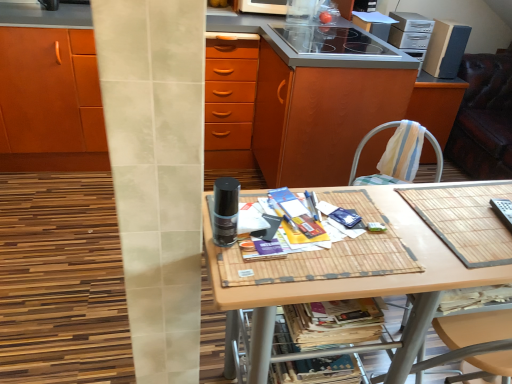
What do you see at coordinates (66, 152) in the screenshot?
I see `matte wood cabinet at center` at bounding box center [66, 152].

Locate an element on the screen. The width and height of the screenshot is (512, 384). striped fabric chair at right is located at coordinates (365, 144).

Where is `wooden at center`? This screenshot has height=384, width=512. wooden at center is located at coordinates (319, 96).

Where is `printed paper magazine at lower center, positioned as the 2th magazine in top-to-bottom order`? printed paper magazine at lower center, positioned as the 2th magazine in top-to-bottom order is located at coordinates (334, 322).

Describe the element at coordinates (446, 49) in the screenshot. I see `cardboard speaker at upper right` at that location.

You are a GUI agent. You are given a task and a screenshot of the screen. Output one action in this format:
    pyautogui.click(x=<x>, y=<y>)
    Task: Click on the transparent plastic container at upper center, placed as the 1th appliance when sorted from top to bottom
    
    Given the screenshot: What is the action you would take?
    pyautogui.click(x=301, y=11)

In order to face black glass stove at upper center, which appears as the 2th appliance when viewed from the top, should I rotate leftwards or rightwards?

To face it directly, rotate right by 9.849 degrees.

Where is `matte wood cabinet at center`? The image size is (512, 384). matte wood cabinet at center is located at coordinates (66, 152).

Considering the sizes of objects matte paper magazine at center, arranged as the 1th magazine when viewed from the top, and wooden at center in the image provided, who is taller, matte paper magazine at center, arranged as the 1th magazine when viewed from the top, or wooden at center?

Standing taller between the two is wooden at center.

Is matte paper magazine at center, arranged as the 1th magazine when viewed from the top, completely or partially outside of wooden at center?

matte paper magazine at center, arranged as the 1th magazine when viewed from the top, is positioned outside wooden at center.

Can you confirm if matte paper magazine at center, arranged as the 1th magazine when viewed from the top, is positioned to the left of wooden at center?

Yes.

The height and width of the screenshot is (384, 512). I want to click on chair in front of the cardboard speaker at upper right, so click(x=365, y=144).

Which of these two, striped fabric chair at right or cardboard speaker at upper right, is smaller?

With smaller size is striped fabric chair at right.

From the picture: From the image's perspective, which one is positioned lower, striped fabric chair at right or cardboard speaker at upper right?

striped fabric chair at right is shown below in the image.

In the scene shown: From a real-world perspective, is striped fabric chair at right over cardboard speaker at upper right?

Actually, striped fabric chair at right is physically below cardboard speaker at upper right in the real world.

In the scene shown: Is bamboo mat at center facing towards black plastic remote control at right, the 3th appliance positioned from the top?

No, bamboo mat at center is not oriented towards black plastic remote control at right, the 3th appliance positioned from the top.

Consider the image. Considering the positions of objects bamboo mat at center and black plastic remote control at right, the 3th appliance in the back-to-front sequence, in the image provided, who is more to the right, bamboo mat at center or black plastic remote control at right, the 3th appliance in the back-to-front sequence,?

black plastic remote control at right, the 3th appliance in the back-to-front sequence.

Between bamboo mat at center and black plastic remote control at right, the 3th appliance positioned from the top, which one is positioned behind?

black plastic remote control at right, the 3th appliance positioned from the top.

Considering the sizes of objects bamboo mat at center and black plastic remote control at right, the 1th appliance when ordered from front to back, in the image provided, who is thinner, bamboo mat at center or black plastic remote control at right, the 1th appliance when ordered from front to back,?

With smaller width is black plastic remote control at right, the 1th appliance when ordered from front to back.

Where is `the 2nd magazine to the left when counting from the cardboard speaker at upper right`? The height and width of the screenshot is (384, 512). the 2nd magazine to the left when counting from the cardboard speaker at upper right is located at coordinates (296, 220).

Considering the relative sizes of matte paper magazine at center, the second magazine in the bottom-to-top sequence, and cardboard speaker at upper right in the image provided, is matte paper magazine at center, the second magazine in the bottom-to-top sequence, taller than cardboard speaker at upper right?

No.

Considering the relative sizes of matte paper magazine at center, arranged as the 1th magazine when viewed from the top, and cardboard speaker at upper right in the image provided, is matte paper magazine at center, arranged as the 1th magazine when viewed from the top, smaller than cardboard speaker at upper right?

Indeed, matte paper magazine at center, arranged as the 1th magazine when viewed from the top, has a smaller size compared to cardboard speaker at upper right.

Is point (298, 239) more distant than point (458, 33)?

No.

Is black glass stove at upper center, the second appliance viewed from the back, smaller than bamboo mat at center?

Yes, black glass stove at upper center, the second appliance viewed from the back, is smaller than bamboo mat at center.

Is black glass stove at upper center, marked as the second appliance in a front-to-back arrangement, aimed at bamboo mat at center?

No.

The height and width of the screenshot is (384, 512). Identify the location of desk that is under the black glass stove at upper center, which is the 2th appliance in bottom-to-top order (from a real-world perspective). (357, 285).

Between black glass stove at upper center, the second appliance viewed from the back, and bamboo mat at center, which one has larger width?

black glass stove at upper center, the second appliance viewed from the back.

From the image's perspective, is matte wood cabinet at center under transparent plastic container at upper center, placed as the 1th appliance when sorted from top to bottom?

Yes, from the image's perspective, matte wood cabinet at center is beneath transparent plastic container at upper center, placed as the 1th appliance when sorted from top to bottom.

From a real-world perspective, which appliance is the 3rd one above the matte wood cabinet at center? Please provide its 2D coordinates.

[(301, 11)]

Based on the photo, does matte wood cabinet at center have a greater height compared to transparent plastic container at upper center, positioned as the third appliance in front-to-back order?

Indeed, matte wood cabinet at center has a greater height compared to transparent plastic container at upper center, positioned as the third appliance in front-to-back order.

Is matte wood cabinet at center completely or partially outside of transparent plastic container at upper center, the 3th appliance ordered from the bottom?

Yes, matte wood cabinet at center is outside of transparent plastic container at upper center, the 3th appliance ordered from the bottom.

Which is in front, leather-like swivel chair at right or matte wood cabinet at center?

matte wood cabinet at center is in front.

Consider the image. Which is nearer, (484, 55) or (434, 157)?

The point (434, 157) is closer.

Is leather-like swivel chair at right aimed at matte wood cabinet at center?

Yes, leather-like swivel chair at right is oriented towards matte wood cabinet at center.

Locate an element on the screen. dresser that appears on the right of matte paper magazine at center, the second magazine in the bottom-to-top sequence is located at coordinates (319, 96).

Find the location of `chair below the cardboard speaker at upper right (from a real-world perspective)`. chair below the cardboard speaker at upper right (from a real-world perspective) is located at coordinates (365, 144).

Estimate the real-world distances between objects in this image. Which object is closer to printed paper magazine at lower center, positioned as the 2th magazine in top-to-bottom order, transparent plastic container at upper center, the 3th appliance ordered from the bottom, or striped fabric chair at right?

The object closer to printed paper magazine at lower center, positioned as the 2th magazine in top-to-bottom order, is striped fabric chair at right.

When comparing their distances from leather-like swivel chair at right, does cardboard speaker at upper right or matte paper magazine at center, the second magazine in the bottom-to-top sequence, seem further?

matte paper magazine at center, the second magazine in the bottom-to-top sequence, lies further to leather-like swivel chair at right than the other object.

When comparing their distances from transparent plastic container at upper center, placed as the 1th appliance when sorted from top to bottom, does leather-like swivel chair at right or matte paper magazine at center, the second magazine in the bottom-to-top sequence, seem closer?

The object closer to transparent plastic container at upper center, placed as the 1th appliance when sorted from top to bottom, is leather-like swivel chair at right.

Considering their positions, is black glass stove at upper center, which appears as the 2th appliance when viewed from the top, positioned further to black plastic remote control at right, acting as the first appliance starting from the bottom, than wooden at center?

The object further to black plastic remote control at right, acting as the first appliance starting from the bottom, is black glass stove at upper center, which appears as the 2th appliance when viewed from the top.

Looking at the image, which one is located further to wooden at center, bamboo mat at center or black plastic remote control at right, acting as the first appliance starting from the bottom?

black plastic remote control at right, acting as the first appliance starting from the bottom, is further to wooden at center.

When comparing their distances from matte wood cabinet at center, does bamboo mat at center or transparent plastic container at upper center, placed as the 1th appliance when sorted from top to bottom, seem closer?

transparent plastic container at upper center, placed as the 1th appliance when sorted from top to bottom.

When comparing their distances from leather-like swivel chair at right, does black glass stove at upper center, the second appliance viewed from the back, or black plastic remote control at right, acting as the first appliance starting from the bottom, seem closer?

black glass stove at upper center, the second appliance viewed from the back, is positioned closer to the anchor leather-like swivel chair at right.

In the scene shown: When comparing their distances from leather-like swivel chair at right, does black plastic remote control at right, the 3th appliance in the back-to-front sequence, or cardboard speaker at upper right seem closer?

cardboard speaker at upper right is closer to leather-like swivel chair at right.

This screenshot has width=512, height=384. Find the location of `dresser located between matte paper magazine at center, the second magazine in the bottom-to-top sequence, and cardboard speaker at upper right in the depth direction`. dresser located between matte paper magazine at center, the second magazine in the bottom-to-top sequence, and cardboard speaker at upper right in the depth direction is located at coordinates (319, 96).

This screenshot has width=512, height=384. What are the coordinates of `chair positioned between matte paper magazine at center, arranged as the 1th magazine when viewed from the top, and cardboard speaker at upper right from near to far` in the screenshot? It's located at (x=365, y=144).

This screenshot has width=512, height=384. I want to click on dresser between striped fabric chair at right and cardboard speaker at upper right in the front-back direction, so click(319, 96).

Locate an element on the screen. cabinetry between wooden at center and bamboo mat at center vertically is located at coordinates (66, 152).